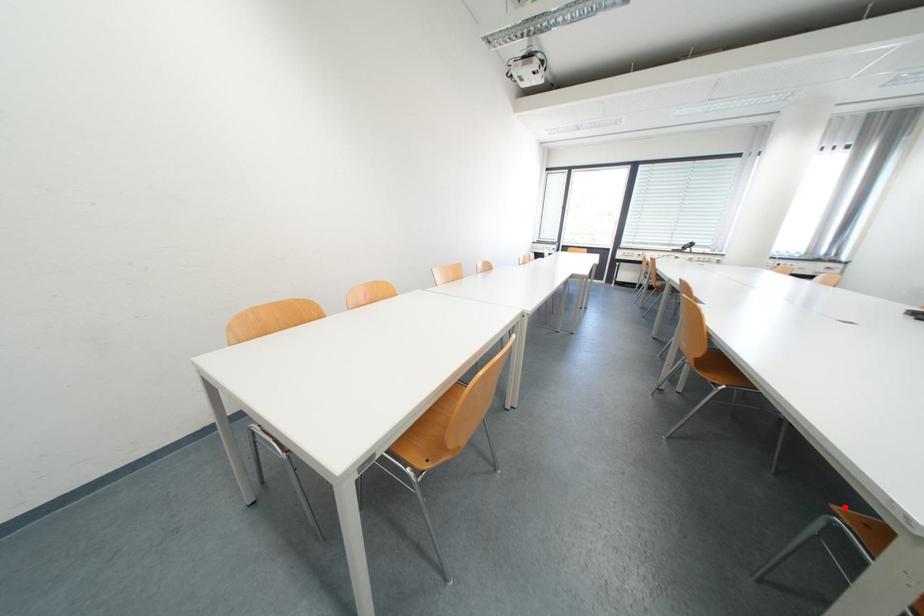
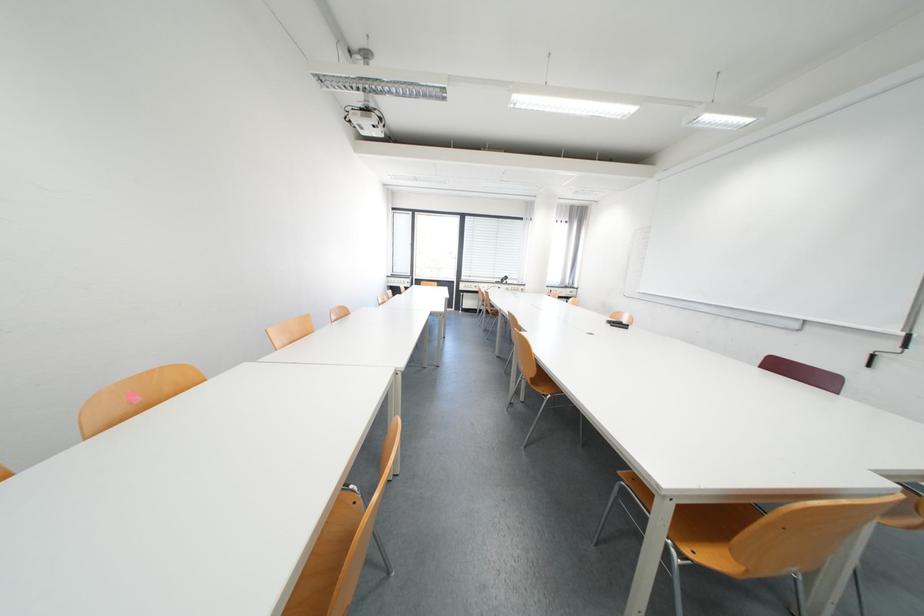
Question: I am providing you with two images of the same scene from different viewpoints. Image1 has a red point marked. In image2, the corresponding 3D location appears at what relative position? Reply with the corresponding letter.

Choices:
 (A) Closer
 (B) Farther

Answer: (A)